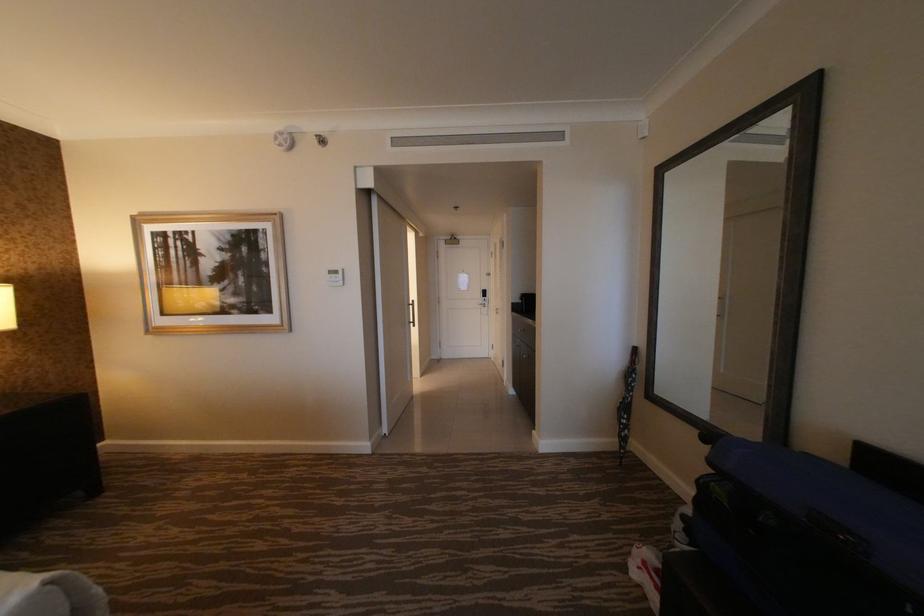
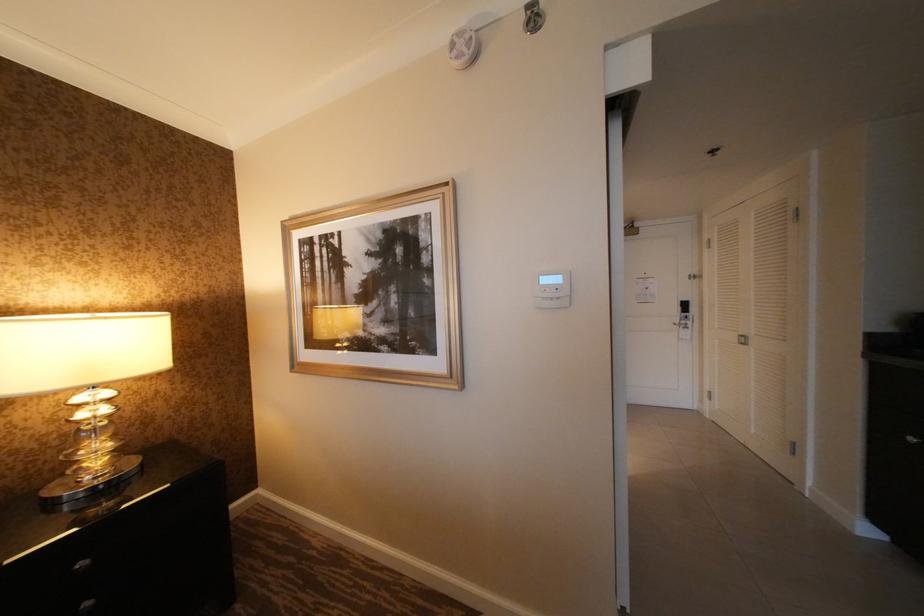
Which direction would the cameraman need to move to produce the second image?

The cameraman walked toward left, forward.